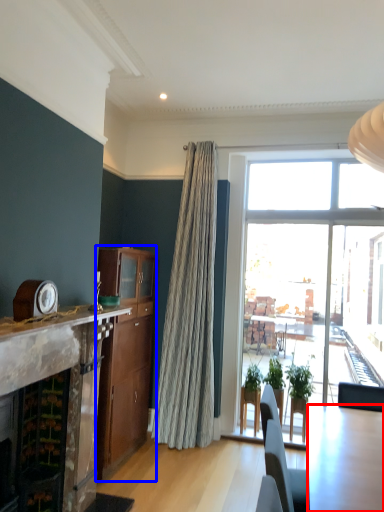
Question: Which object appears closest to the camera in this image, kitchen & dining room table (highlighted by a red box) or cabinetry (highlighted by a blue box)?

Choices:
 (A) kitchen & dining room table
 (B) cabinetry

Answer: (A)